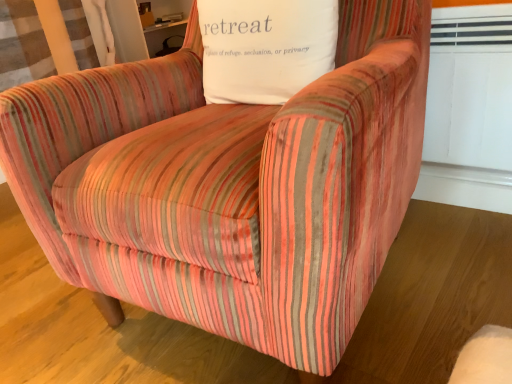
What do you see at coordinates (265, 48) in the screenshot? This screenshot has width=512, height=384. I see `white cotton pillow at upper center` at bounding box center [265, 48].

The height and width of the screenshot is (384, 512). What are the coordinates of `white cotton pillow at upper center` in the screenshot? It's located at (265, 48).

Locate an element on the screen. This screenshot has width=512, height=384. white cotton pillow at upper center is located at coordinates (265, 48).